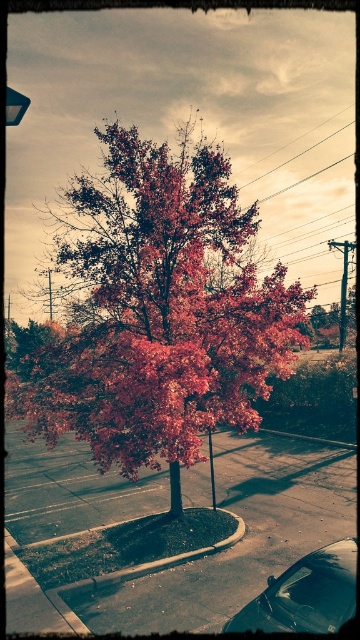
Question: Which point is farther to the camera?

Choices:
 (A) (216, 268)
 (B) (335, 572)

Answer: (A)

Question: Is shiny red maple tree at center positioned in front of shiny black car at lower right?

Choices:
 (A) yes
 (B) no

Answer: (B)

Question: Does shiny red maple tree at center have a lesser width compared to shiny black car at lower right?

Choices:
 (A) no
 (B) yes

Answer: (A)

Question: Is the position of shiny red maple tree at center less distant than that of shiny black car at lower right?

Choices:
 (A) yes
 (B) no

Answer: (B)

Question: Which point is farther to the camera?

Choices:
 (A) (306, 577)
 (B) (105, 260)

Answer: (B)